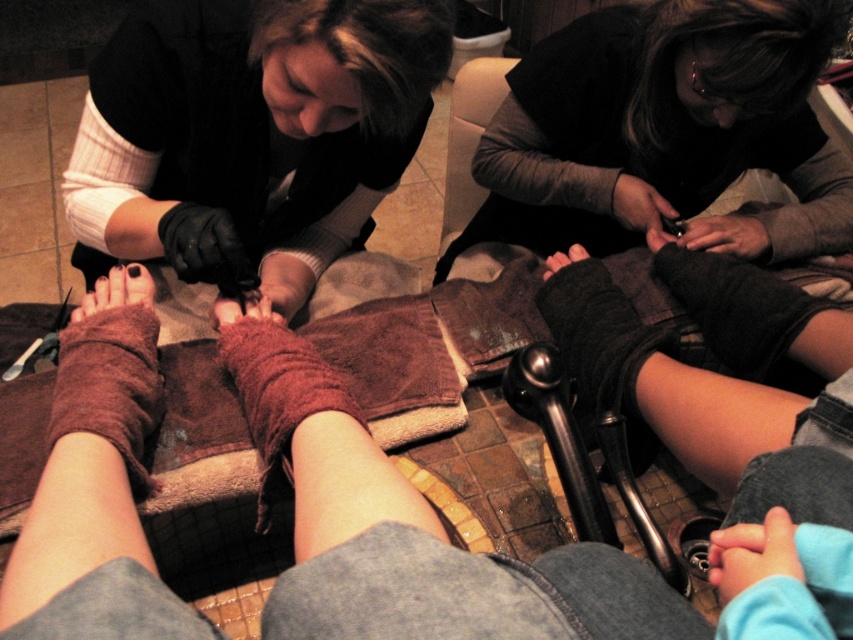
Which of these two, dark gray wool sock at lower right or brown fuzzy sock at lower left, stands taller?

With more height is brown fuzzy sock at lower left.

Can you confirm if dark gray wool sock at lower right is wider than brown fuzzy sock at lower left?

Incorrect, dark gray wool sock at lower right's width does not surpass brown fuzzy sock at lower left's.

Who is more distant from viewer, [732,288] or [99,324]?

The point [732,288] is more distant.

This screenshot has height=640, width=853. In order to click on dark gray wool sock at lower right in this screenshot , I will do `click(753, 314)`.

Which is below, black fuzzy socks at lower center or matte black nail file at lower center?

Positioned lower is black fuzzy socks at lower center.

Does black fuzzy socks at lower center have a smaller size compared to matte black nail file at lower center?

Incorrect, black fuzzy socks at lower center is not smaller in size than matte black nail file at lower center.

Which is behind, point (625, 406) or point (646, 236)?

Point (646, 236)

Identify the location of black fuzzy socks at lower center. (660, 378).

Does black fuzzy socks at lower center appear under matte black nail clipper at lower center?

Yes, black fuzzy socks at lower center is below matte black nail clipper at lower center.

Can you confirm if black fuzzy socks at lower center is taller than matte black nail clipper at lower center?

Correct, black fuzzy socks at lower center is much taller as matte black nail clipper at lower center.

What are the coordinates of `black fuzzy socks at lower center` in the screenshot? It's located at (660, 378).